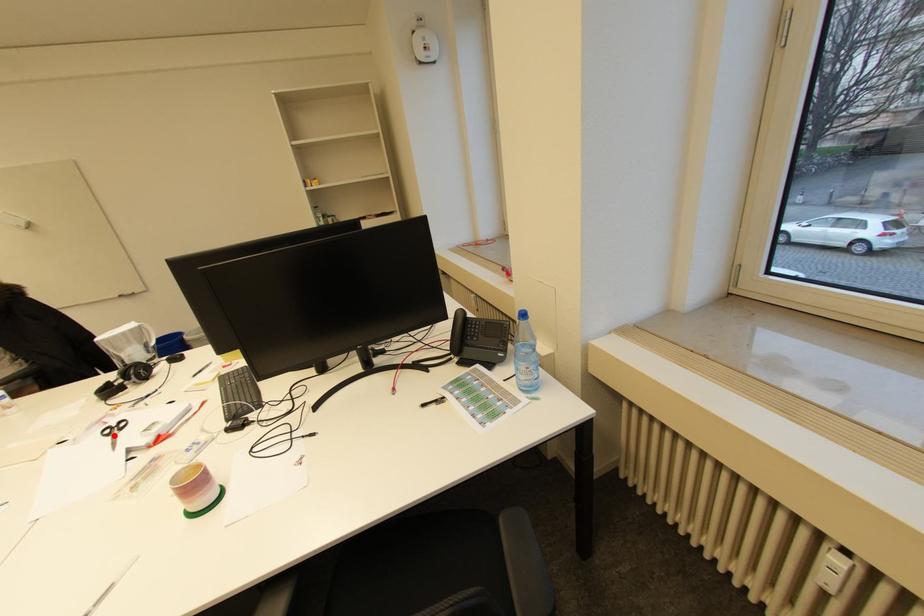
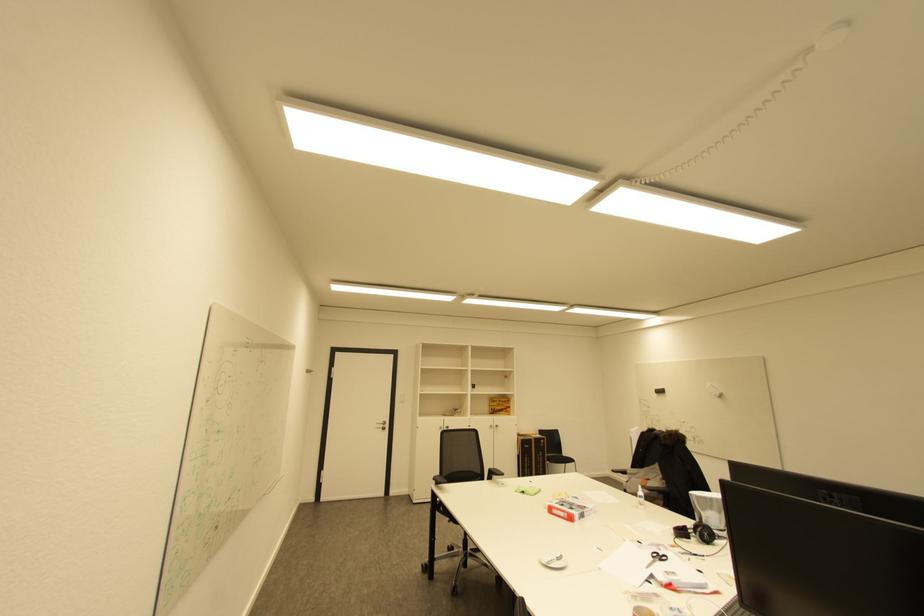
The point at the highlighted location is marked in the first image. Where is the corresponding point in the second image?

(659, 557)